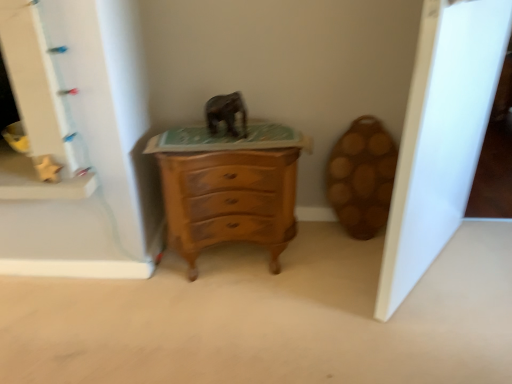
Locate an element on the screen. Image resolution: width=512 pixels, height=384 pixels. vacant position to the left of white glossy door at right is located at coordinates (322, 279).